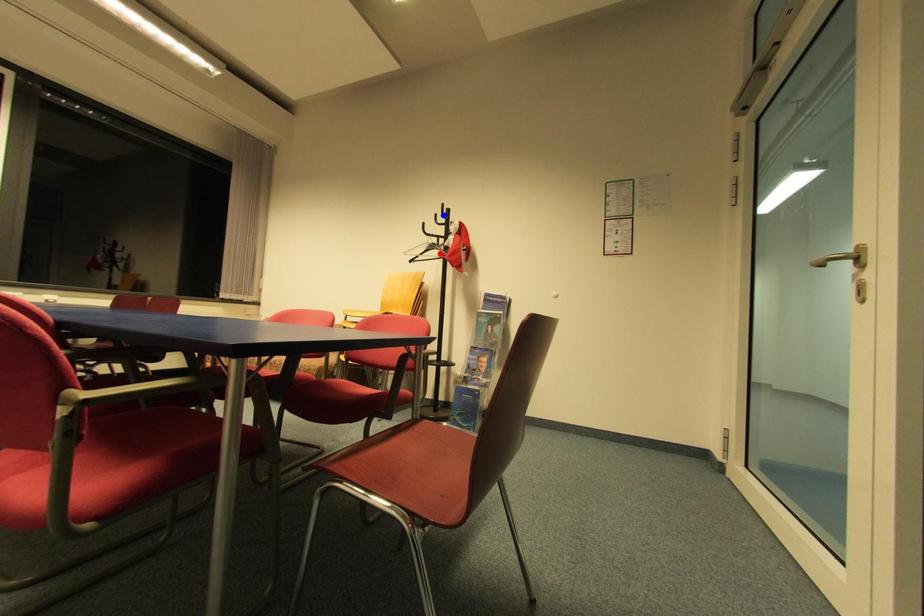
Question: Which of the two points in the image is closer to the camera?

Choices:
 (A) Blue point is closer.
 (B) Red point is closer.

Answer: (B)